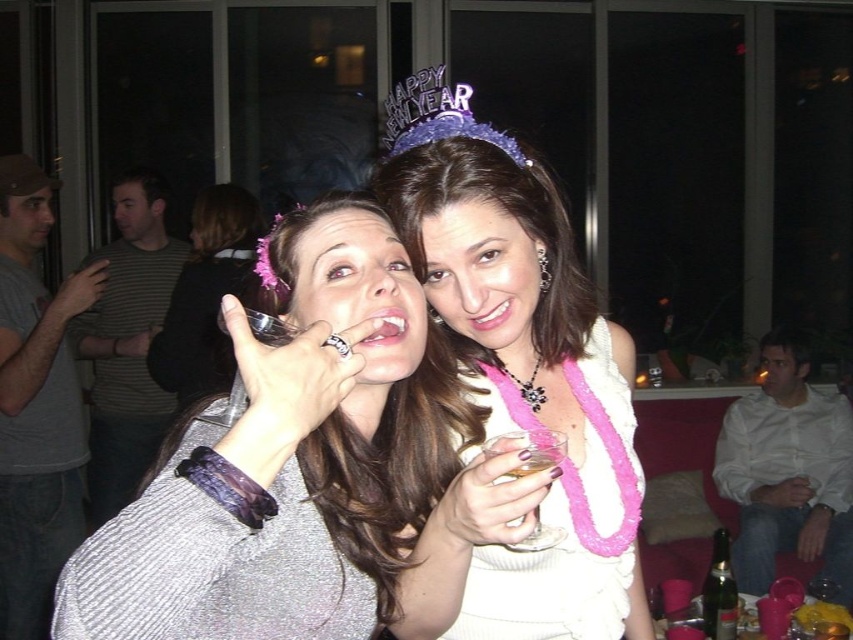
Question: Based on their relative distances, which object is nearer to the shiny silver ring at center?

Choices:
 (A) white shirt at center
 (B) purple glittery tiara at upper center
 (C) shiny silver dress at center

Answer: (B)

Question: Which object appears closest to the camera in this image?

Choices:
 (A) white shirt at center
 (B) gray fabric shirt at left
 (C) shiny silver dress at center
 (D) clear glass wine glass at center

Answer: (C)

Question: Is purple glittery tiara at upper center bigger than green glass bottle at lower right?

Choices:
 (A) no
 (B) yes

Answer: (A)

Question: Is sparkly white dress at center thinner than white shirt at center?

Choices:
 (A) no
 (B) yes

Answer: (B)

Question: Based on their relative distances, which object is farther from the purple glittery tiara at upper center?

Choices:
 (A) shiny silver dress at center
 (B) shiny silver ring at center
 (C) sparkly white dress at center

Answer: (B)

Question: Is shiny silver dress at center bigger than clear glass wine glass at center?

Choices:
 (A) no
 (B) yes

Answer: (B)